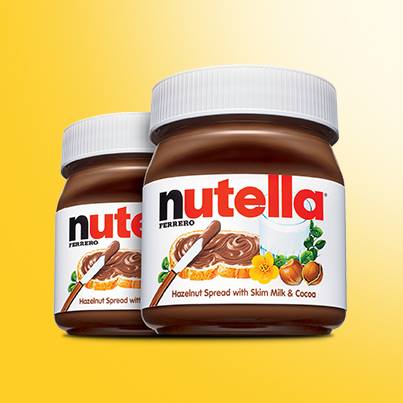
Identify the location of glass of milk. Image resolution: width=403 pixels, height=403 pixels. (292, 234).